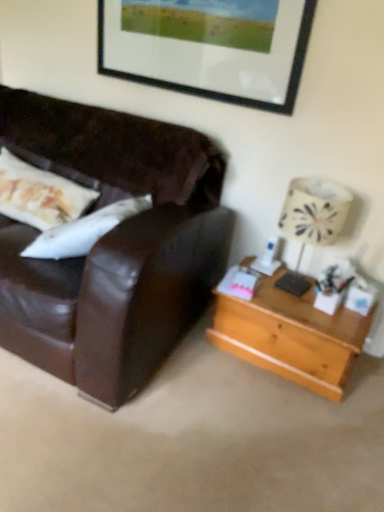
Identify the location of blank space situated above light brown wooden table at right (from a real-world perspective). The image size is (384, 512). (298, 294).